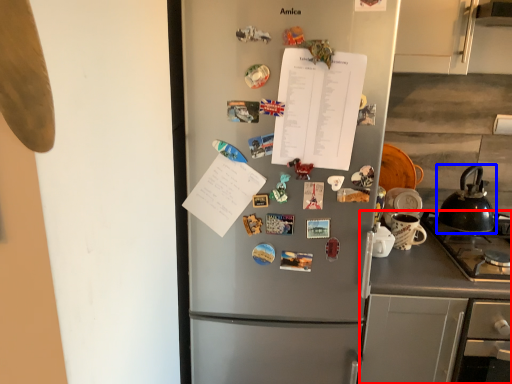
Question: Which point is closer to the camera, counter (highlighted by a red box) or kettle (highlighted by a blue box)?

Choices:
 (A) counter
 (B) kettle

Answer: (A)